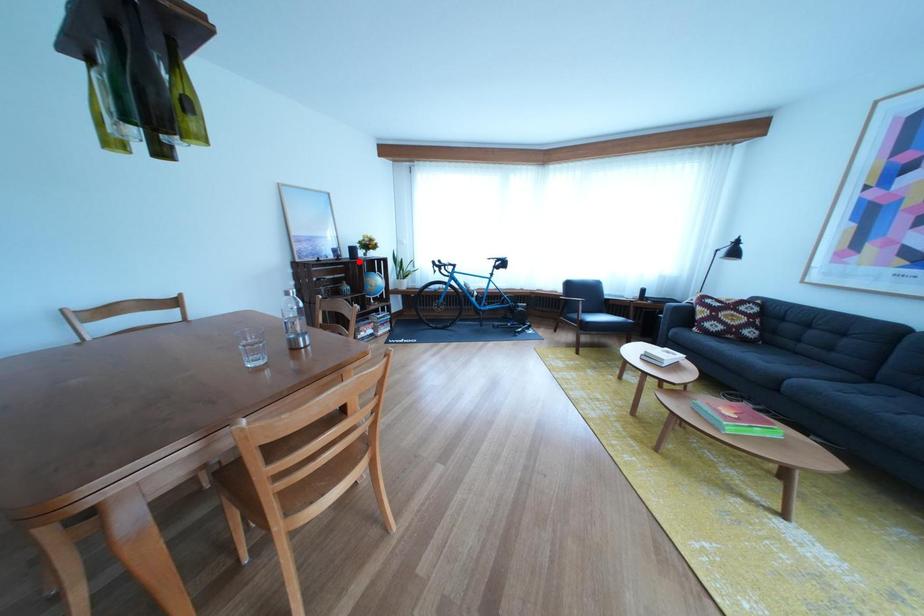
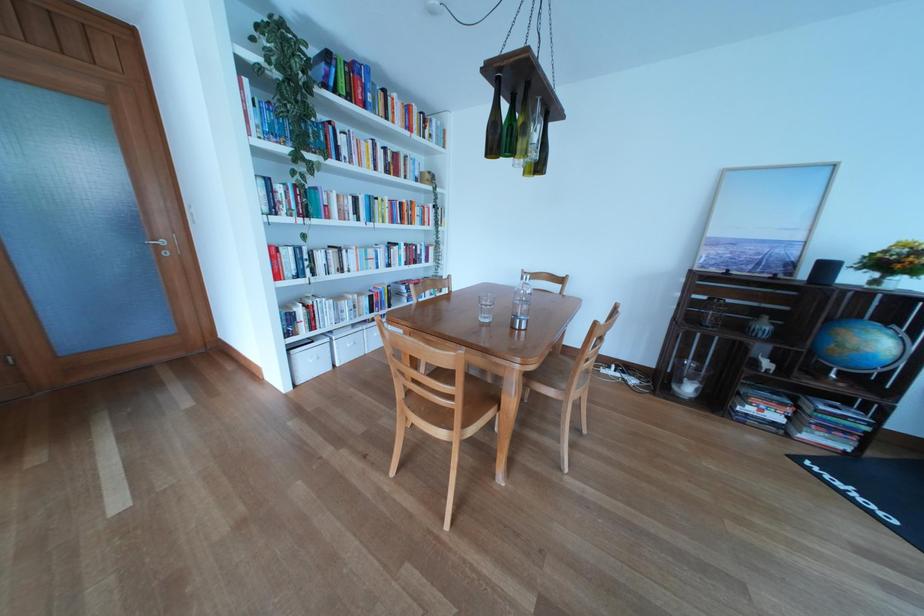
Question: I am providing you with two images of the same scene from different viewpoints. In image1, a red point is highlighted. Considering the same 3D point in image2, which of the following is correct?

Choices:
 (A) It is closer
 (B) It is farther

Answer: (B)